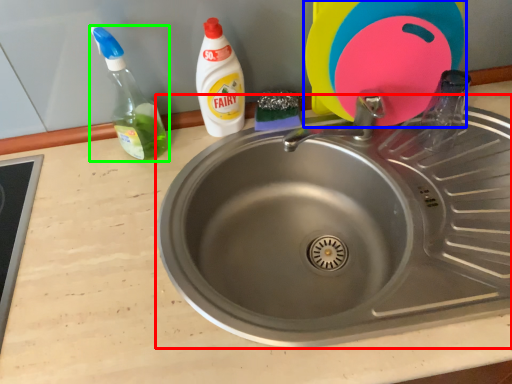
Question: Which object is positioned farthest from sink (highlighted by a red box)? Select from toy (highlighted by a blue box) and bottle (highlighted by a green box).

Choices:
 (A) toy
 (B) bottle

Answer: (B)